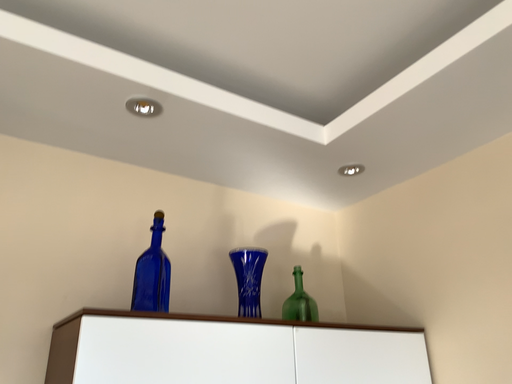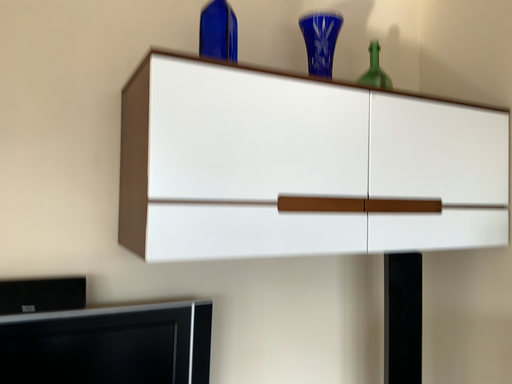
Question: Which way did the camera rotate in the video?

Choices:
 (A) rotated downward
 (B) rotated upward

Answer: (A)